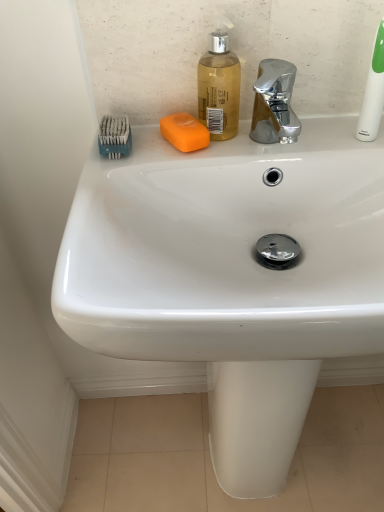
You are a GUI agent. You are given a task and a screenshot of the screen. Output one action in this format:
    pyautogui.click(x=<x>, y=<y>)
    Task: Click on the vacant area that is in front of orange matte soap at center
    The height and width of the screenshot is (512, 384).
    Given the screenshot: What is the action you would take?
    pyautogui.click(x=169, y=169)